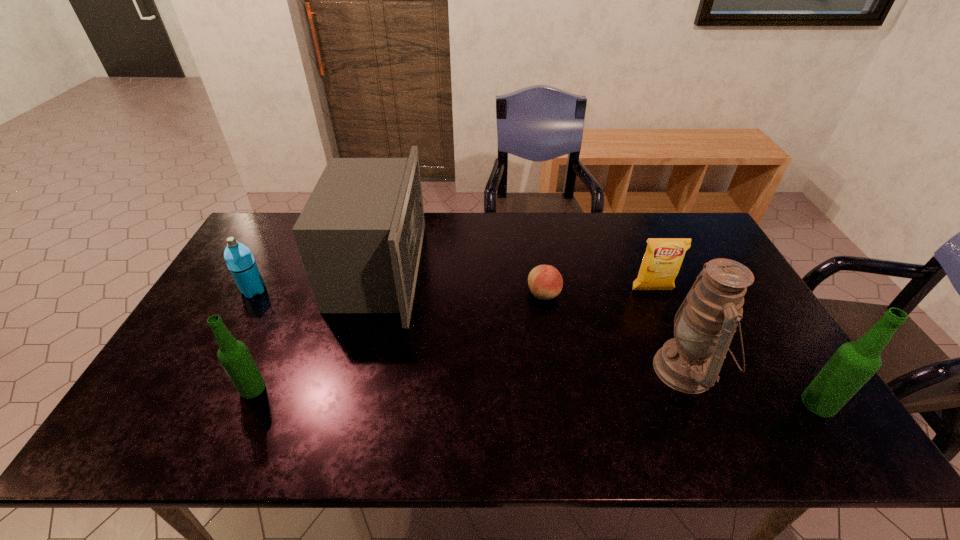
Locate an element on the screen. This screenshot has height=540, width=960. the left beer bottle is located at coordinates (235, 358).

The width and height of the screenshot is (960, 540). I want to click on the fourth shortest object, so coord(235,358).

I want to click on the rightmost object, so click(x=854, y=363).

The width and height of the screenshot is (960, 540). In order to click on the right beer bottle in this screenshot , I will do `click(854, 363)`.

In order to click on microwave oven in this screenshot , I will do `click(360, 234)`.

The width and height of the screenshot is (960, 540). I want to click on thermos bottle, so click(239, 259).

The image size is (960, 540). What are the coordinates of `peach` in the screenshot? It's located at (545, 282).

Where is `the fourth object from right to left`? the fourth object from right to left is located at coordinates (545, 282).

Identify the location of crisp (potato chip). (662, 260).

The height and width of the screenshot is (540, 960). In order to click on oil lamp in this screenshot , I will do `click(704, 325)`.